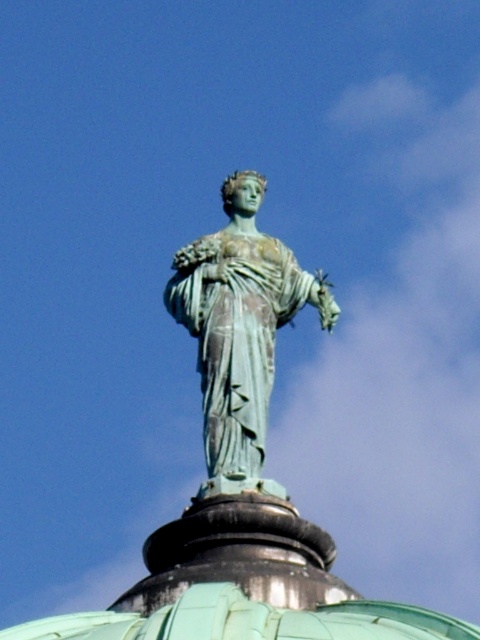
Question: Which point appears closest to the camera in this image?

Choices:
 (A) (195, 257)
 (B) (210, 620)

Answer: (B)

Question: Among these objects, which one is nearest to the camera?

Choices:
 (A) green patina statue at center
 (B) green copper dome at center

Answer: (B)

Question: Is green patina statue at center smaller than green copper dome at center?

Choices:
 (A) yes
 (B) no

Answer: (A)

Question: Where is green patina statue at center located in relation to green copper dome at center in the image?

Choices:
 (A) left
 (B) right

Answer: (B)

Question: Can you confirm if green patina statue at center is positioned to the right of green copper dome at center?

Choices:
 (A) yes
 (B) no

Answer: (A)